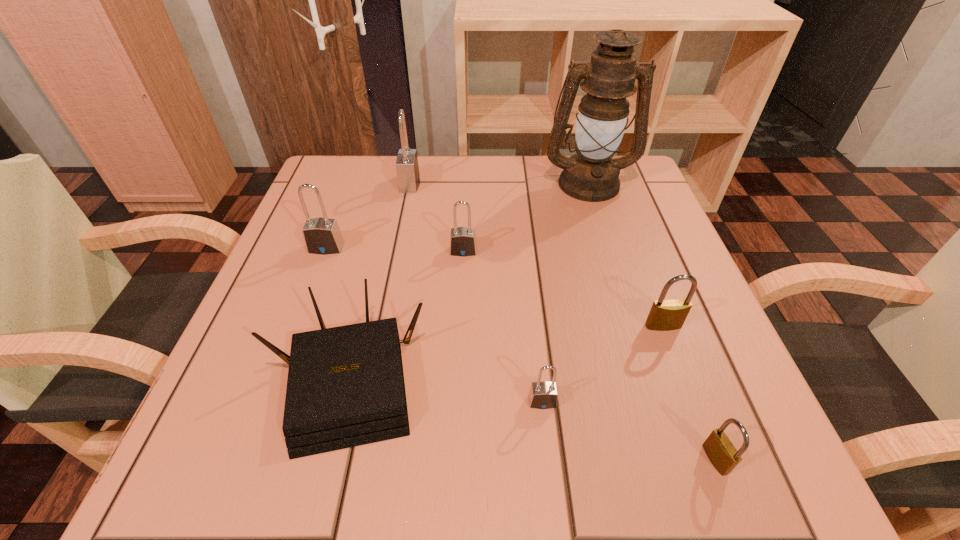
At what (x,y) coordinates should I click in order to perform the action: click on free space between the sixth shortest object and the rightmost gray padlock. Please return your answer as a coordinate pair (x, y). The width and height of the screenshot is (960, 540). Looking at the image, I should click on (434, 325).

Where is `vacant area that lies between the nearer brass padlock and the router`? This screenshot has width=960, height=540. vacant area that lies between the nearer brass padlock and the router is located at coordinates (531, 420).

Find the location of a particular element. The width and height of the screenshot is (960, 540). free point between the farther brass padlock and the rightmost gray padlock is located at coordinates (603, 363).

In order to click on vacant point located between the fifth object from right to left and the router in this screenshot , I will do `click(405, 316)`.

I want to click on free space between the tallest padlock and the third nearest padlock, so click(x=537, y=254).

You are a GUI agent. You are given a task and a screenshot of the screen. Output one action in this format:
    pyautogui.click(x=<x>, y=<y>)
    Task: Click on the blank region between the black router and the nearest gray padlock
    The height and width of the screenshot is (540, 960).
    Given the screenshot: What is the action you would take?
    pyautogui.click(x=444, y=392)

Where is `free space between the farther brass padlock and the nearer brass padlock`? free space between the farther brass padlock and the nearer brass padlock is located at coordinates (689, 393).

Locate an element on the screen. object that is the sixth closest one to the black router is located at coordinates (719, 449).

The image size is (960, 540). Find the location of `object that stands as the fifth closest to the seventh shortest object`. object that stands as the fifth closest to the seventh shortest object is located at coordinates (543, 395).

Identify the location of padlock that is the closest to the smaller brass padlock. (670, 314).